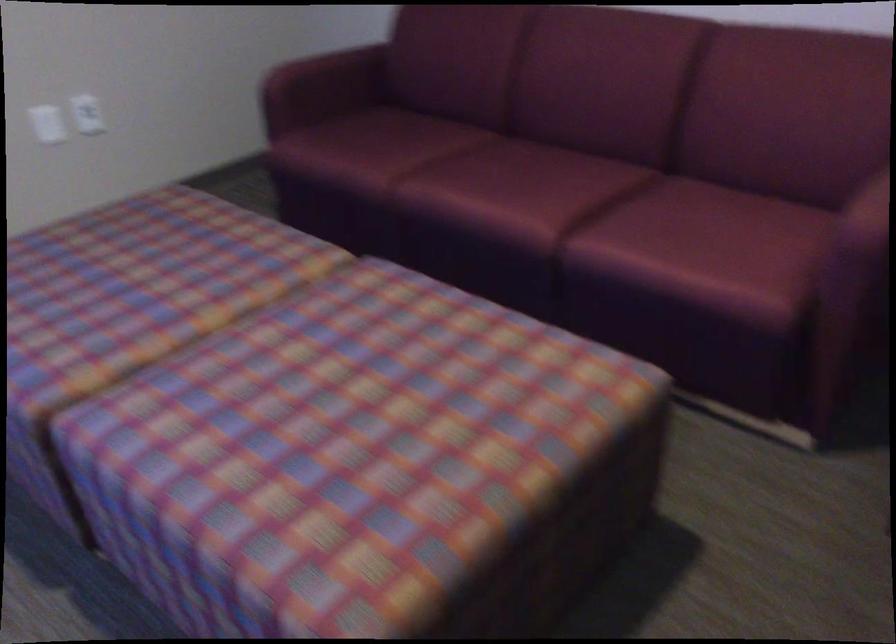
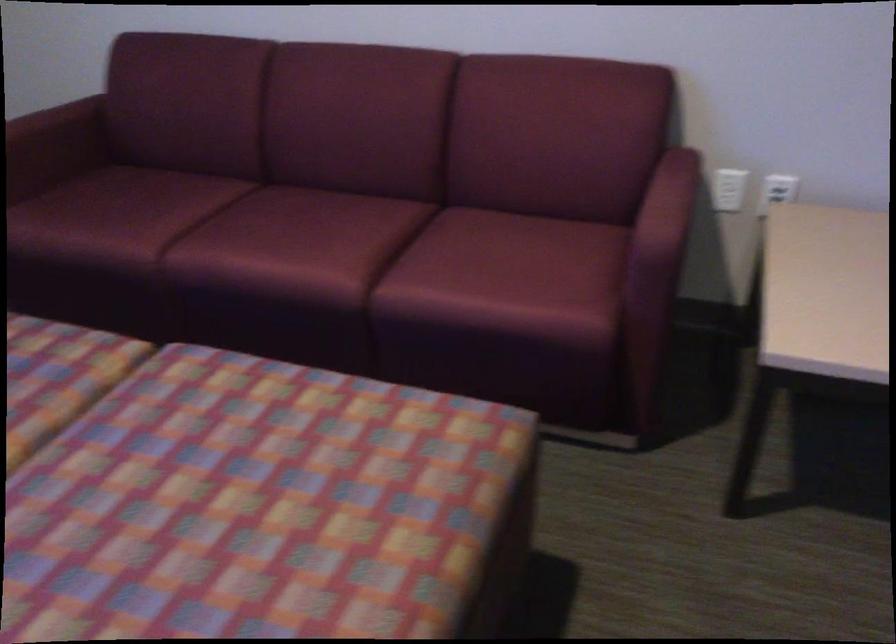
Where in the second image is the point corresponding to (535,199) from the first image?

(332, 249)